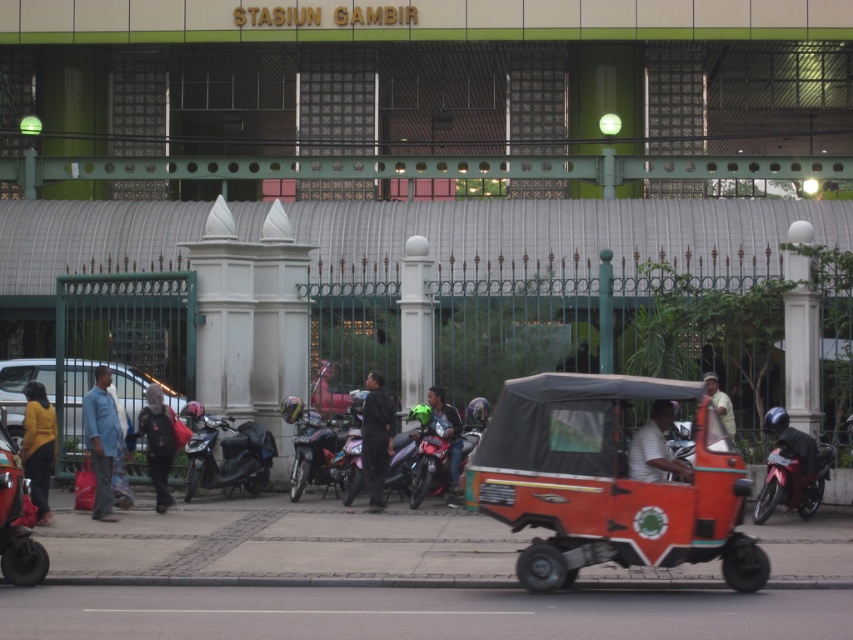
Can you confirm if dark blue fabric jacket at center is thinner than light brown leather jacket at center?

No, dark blue fabric jacket at center is not thinner than light brown leather jacket at center.

Does dark blue fabric jacket at center have a larger size compared to light brown leather jacket at center?

Yes, dark blue fabric jacket at center is bigger than light brown leather jacket at center.

Which is behind, point (148, 445) or point (706, 371)?

Point (706, 371)

Where is `dark blue fabric jacket at center`? The width and height of the screenshot is (853, 640). dark blue fabric jacket at center is located at coordinates (158, 442).

Who is positioned more to the left, matte blue car at left or light brown leather jacket at center?

From the viewer's perspective, matte blue car at left appears more on the left side.

Is matte blue car at left to the left of light brown leather jacket at center from the viewer's perspective?

Indeed, matte blue car at left is positioned on the left side of light brown leather jacket at center.

Describe the element at coordinates (22, 387) in the screenshot. This screenshot has width=853, height=640. I see `matte blue car at left` at that location.

Find the location of `matte blue car at left`. matte blue car at left is located at coordinates (22, 387).

The image size is (853, 640). What do you see at coordinates (314, 452) in the screenshot? I see `metallic silver motorcycle at center` at bounding box center [314, 452].

Can you confirm if metallic silver motorcycle at center is positioned to the right of light brown leather jacket at center?

Incorrect, metallic silver motorcycle at center is not on the right side of light brown leather jacket at center.

The width and height of the screenshot is (853, 640). What do you see at coordinates (314, 452) in the screenshot?
I see `metallic silver motorcycle at center` at bounding box center [314, 452].

I want to click on metallic silver motorcycle at center, so click(314, 452).